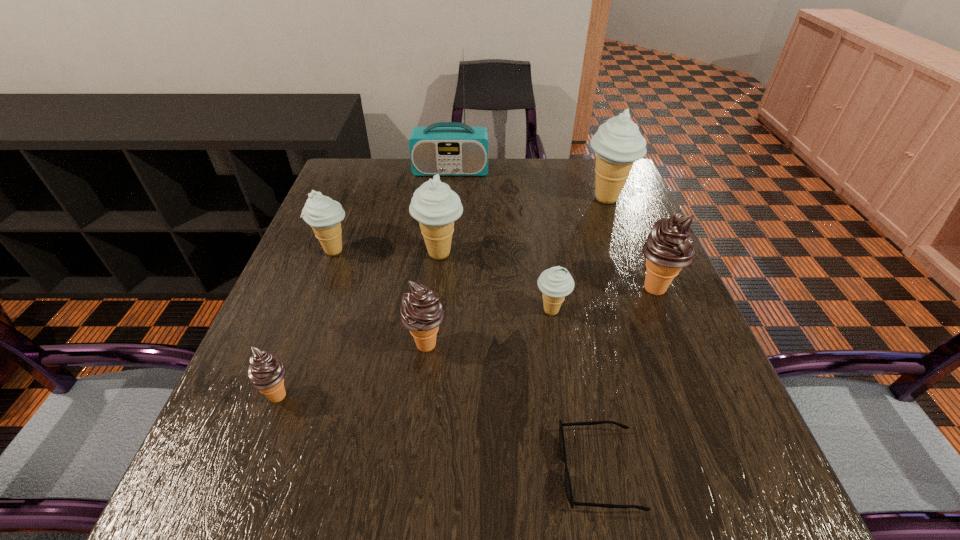
Locate an element on the screen. This screenshot has width=960, height=540. the fifth icecream from left to right is located at coordinates (555, 283).

Identify the location of the nearest beige icecream. This screenshot has height=540, width=960. (555, 283).

Identify the location of the smallest chocolate icecream. The image size is (960, 540). click(266, 373).

Find the location of a particular element. the nearest chocolate icecream is located at coordinates (266, 373).

The image size is (960, 540). In order to click on the shortest object in this screenshot , I will do `click(568, 487)`.

I want to click on sunglasses, so click(568, 487).

Identify the location of vacant space situated on the front panel of the light radio receiver. The width and height of the screenshot is (960, 540). (447, 207).

The image size is (960, 540). I want to click on free region located 0.310m on the front of the biggest beige icecream, so click(x=643, y=295).

This screenshot has height=540, width=960. What are the coordinates of `free space located on the left of the rightmost chocolate icecream` in the screenshot? It's located at [461, 289].

Where is `free point located on the right of the third smallest beige icecream`? This screenshot has height=540, width=960. free point located on the right of the third smallest beige icecream is located at coordinates (617, 253).